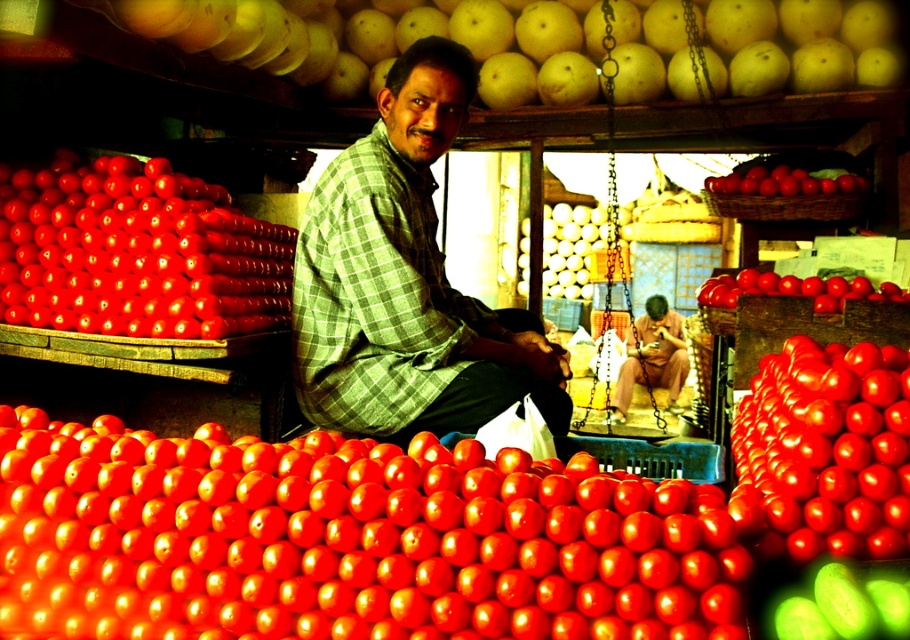
Question: Based on their relative distances, which object is farther from the shiny red tomato at lower left?

Choices:
 (A) green checkered shirt at center
 (B) shiny red tomato at upper right
 (C) glossy red tomato at upper right
 (D) shiny red tomato at left

Answer: (C)

Question: Is green checkered shirt at center positioned before shiny red tomato at upper right?

Choices:
 (A) yes
 (B) no

Answer: (A)

Question: Can you confirm if matte green shirt at center is wider than glossy red tomato at upper right?

Choices:
 (A) yes
 (B) no

Answer: (A)

Question: Is shiny red tomato at left further to camera compared to shiny red tomato at upper right?

Choices:
 (A) no
 (B) yes

Answer: (A)

Question: Among these points, which one is farthest from the camera?

Choices:
 (A) (423, 232)
 (B) (797, 465)

Answer: (A)

Question: Which point is closer to the camera?

Choices:
 (A) matte green shirt at center
 (B) green checkered shirt at center
 (C) shiny red tomato at left
 (D) glossy red tomato at upper right

Answer: (B)